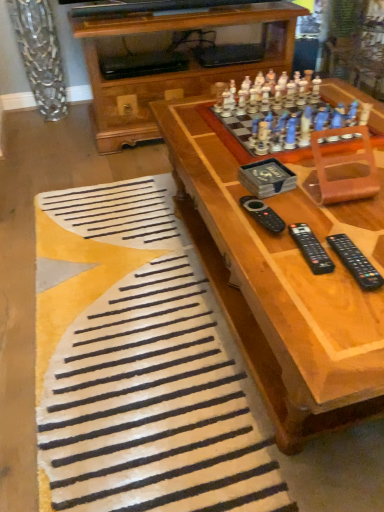
Image resolution: width=384 pixels, height=512 pixels. I want to click on unoccupied space behind black plastic remote at lower right, which appears as the first remote when viewed from the right, so click(x=334, y=220).